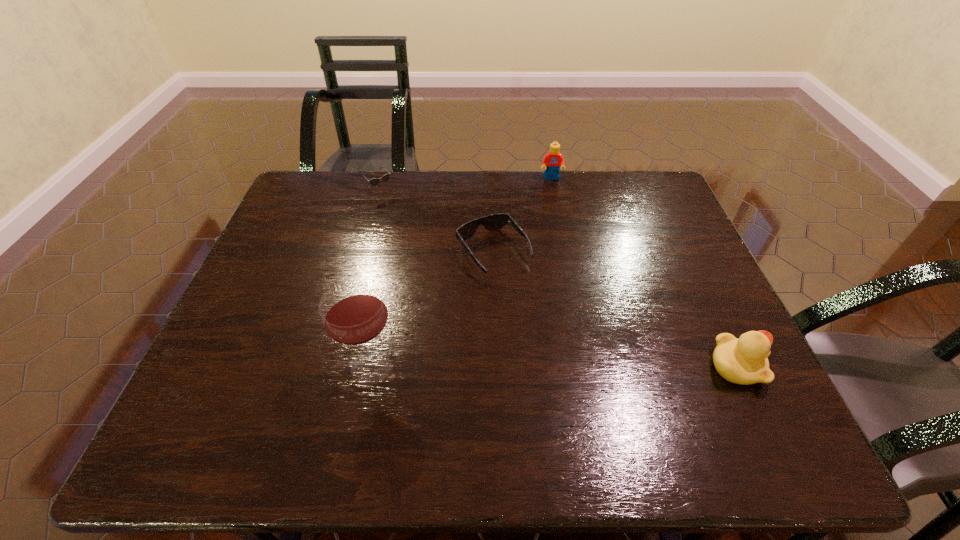
You are a GUI agent. You are given a task and a screenshot of the screen. Output one action in this format:
    pyautogui.click(x=<x>, y=<y>)
    Task: Click on the Lego located at the far edge
    This screenshot has height=540, width=960.
    Given the screenshot: What is the action you would take?
    pyautogui.click(x=552, y=161)

Locate an element on the screen. wineglass located in the near edge section of the desktop is located at coordinates 354,313.

At what (x,y) coordinates should I click in order to perform the action: click on duckling present at the near edge. Please return your answer as a coordinate pair (x, y). The image size is (960, 540). Looking at the image, I should click on (744, 361).

You are a GUI agent. You are given a task and a screenshot of the screen. Output one action in this format:
    pyautogui.click(x=<x>, y=<y>)
    Task: Click on the object that is positioned at the right edge
    Image resolution: width=960 pixels, height=540 pixels.
    Given the screenshot: What is the action you would take?
    pyautogui.click(x=744, y=361)

Locate an element on the screen. object positioned at the near right corner is located at coordinates (744, 361).

Find the location of a particular element. free space at the far edge of the desktop is located at coordinates (425, 174).

You are a GUI agent. You are given a task and a screenshot of the screen. Output one action in this format:
    pyautogui.click(x=<x>, y=<y>)
    Task: Click on the vacant space at the near edge
    This screenshot has width=960, height=540.
    Given the screenshot: What is the action you would take?
    pyautogui.click(x=478, y=398)

Locate an element on the screen. This screenshot has width=960, height=540. blank space at the left edge is located at coordinates (300, 277).

At what (x,y) coordinates should I click in order to perform the action: click on free space at the far left corner. Please return your answer as a coordinate pair (x, y). Looking at the image, I should click on (343, 194).

In order to click on vacant space at the far right corner in this screenshot , I will do `click(649, 199)`.